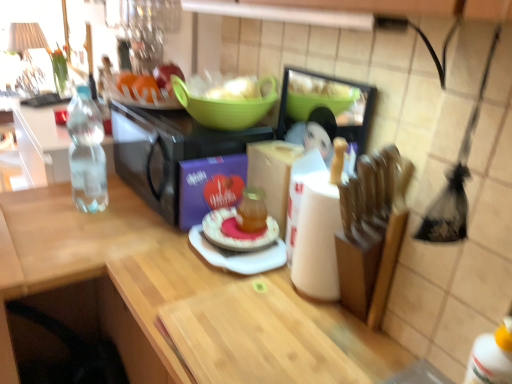
Question: Does black matte microwave at center, which is counted as the first appliance, starting from the left, come in front of green plastic bowl at upper center?

Choices:
 (A) yes
 (B) no

Answer: (B)

Question: Does black matte microwave at center, which is the second appliance in right-to-left order, have a lesser height compared to green plastic bowl at upper center?

Choices:
 (A) yes
 (B) no

Answer: (B)

Question: Is black matte microwave at center, which is counted as the first appliance, starting from the left, touching green plastic bowl at upper center?

Choices:
 (A) no
 (B) yes

Answer: (A)

Question: Can you confirm if black matte microwave at center, which is the second appliance in right-to-left order, is taller than green plastic bowl at upper center?

Choices:
 (A) no
 (B) yes

Answer: (B)

Question: Is black matte microwave at center, which is counted as the first appliance, starting from the left, positioned far away from green plastic bowl at upper center?

Choices:
 (A) no
 (B) yes

Answer: (A)

Question: Is black matte microwave at center, which is counted as the first appliance, starting from the left, in front of or behind green plastic bowl at upper center in the image?

Choices:
 (A) behind
 (B) front

Answer: (A)

Question: Is point (256, 139) closer or farther from the camera than point (245, 119)?

Choices:
 (A) farther
 (B) closer

Answer: (A)

Question: Based on their sizes in the image, would you say black matte microwave at center, which is counted as the first appliance, starting from the left, is bigger or smaller than green plastic bowl at upper center?

Choices:
 (A) big
 (B) small

Answer: (A)

Question: From a real-world perspective, is black matte microwave at center, which is counted as the first appliance, starting from the left, positioned above or below green plastic bowl at upper center?

Choices:
 (A) above
 (B) below

Answer: (B)

Question: Does point (267, 104) appear closer or farther from the camera than point (98, 144)?

Choices:
 (A) farther
 (B) closer

Answer: (B)

Question: From the image's perspective, is green plastic bowl at upper center located above or below clear plastic bottle at left?

Choices:
 (A) above
 (B) below

Answer: (A)

Question: Considering the relative positions of green plastic bowl at upper center and clear plastic bottle at left in the image provided, is green plastic bowl at upper center to the left or to the right of clear plastic bottle at left?

Choices:
 (A) right
 (B) left

Answer: (A)

Question: Considering their positions, is green plastic bowl at upper center located in front of or behind clear plastic bottle at left?

Choices:
 (A) front
 (B) behind

Answer: (A)

Question: Considering their positions, is green plastic bowl at upper center located in front of or behind pink glossy plate at center?

Choices:
 (A) front
 (B) behind

Answer: (B)

Question: Is green plastic bowl at upper center bigger or smaller than pink glossy plate at center?

Choices:
 (A) small
 (B) big

Answer: (B)